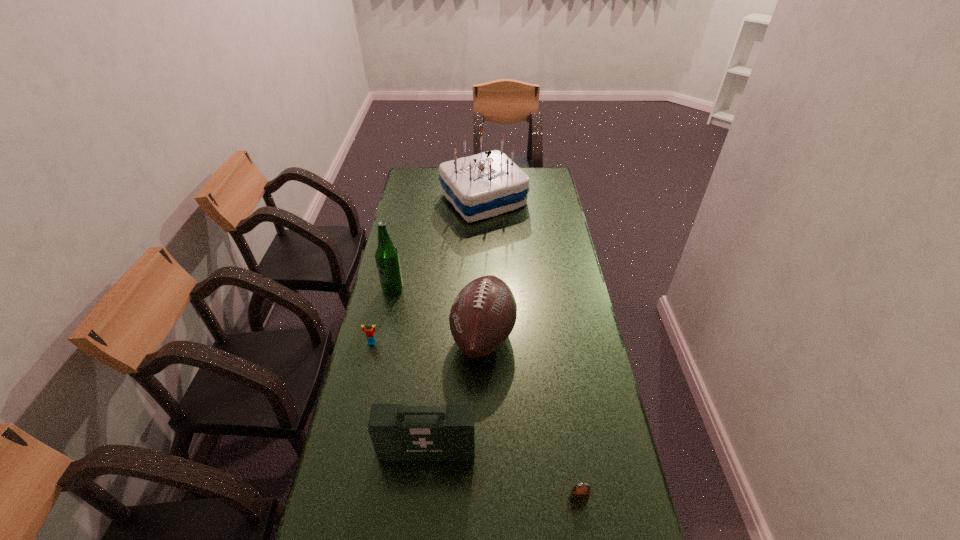
Identify the location of the farthest object. (487, 184).

Locate an element on the screen. beer bottle is located at coordinates (387, 256).

I want to click on football (American), so click(x=483, y=315).

At what (x,y) coordinates should I click in order to perform the action: click on the second nearest object. Please return your answer as a coordinate pair (x, y). This screenshot has height=540, width=960. Looking at the image, I should click on (398, 433).

The width and height of the screenshot is (960, 540). What are the coordinates of `Lego` in the screenshot? It's located at (370, 334).

The height and width of the screenshot is (540, 960). In order to click on the nearest object in this screenshot , I will do `click(578, 494)`.

I want to click on vacant point located on the front of the birthday cake, so coord(484,270).

This screenshot has height=540, width=960. What are the coordinates of `vacant space positioned 0.090m on the label of the beer bottle` in the screenshot? It's located at (387, 314).

At what (x,y) coordinates should I click in order to perform the action: click on vacant area situated 0.380m on the front of the football (American). Please return your answer as a coordinate pair (x, y). Looking at the image, I should click on (485, 507).

Where is `free space located on the front-facing side of the second nearest object`? This screenshot has height=540, width=960. free space located on the front-facing side of the second nearest object is located at coordinates (421, 509).